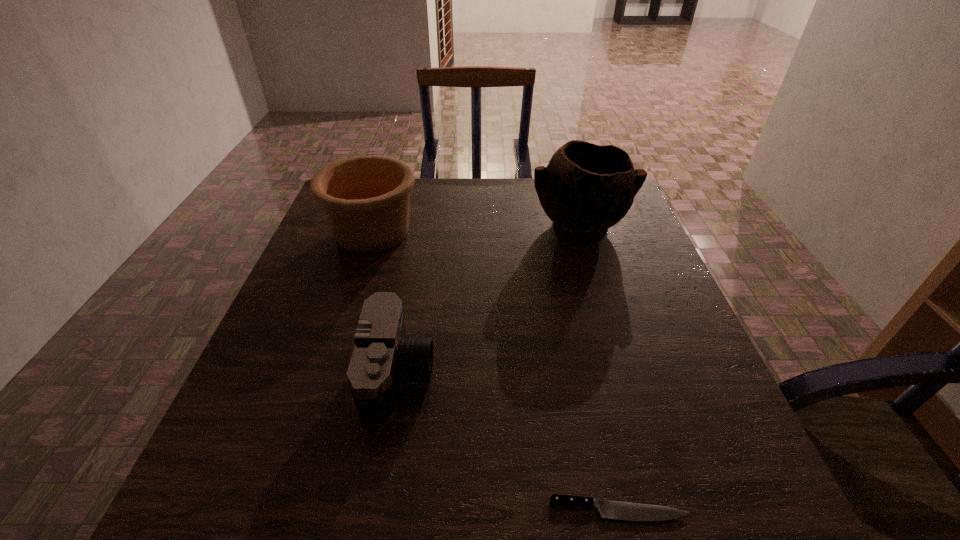
Where is `vacant area between the tallest object and the second nearest object`? vacant area between the tallest object and the second nearest object is located at coordinates (490, 301).

Identify the location of free space between the left pottery and the nearest object. The image size is (960, 540). (496, 371).

Locate an element on the screen. Image resolution: width=960 pixels, height=540 pixels. free space between the second shortest object and the tallest object is located at coordinates (490, 301).

Locate which object is the third closest to the shorter pottery. Please provide its 2D coordinates. Your answer should be formatted as a tuple, i.e. [(x, y)], where the tuple contains the x and y coordinates of a point satisfying the conditions above.

[(615, 510)]

The image size is (960, 540). I want to click on the closest object to the tallest object, so click(365, 199).

This screenshot has height=540, width=960. What are the coordinates of `vacant area in the image that satisfies the following two spatial constraints: 1. on the front-facing side of the second shortest object; 2. on the left side of the shortest object` in the screenshot? It's located at (377, 510).

This screenshot has height=540, width=960. What are the coordinates of `vacant region that satisfies the following two spatial constraints: 1. on the front-facing side of the nearest object; 2. on the left side of the second shortest object` in the screenshot? It's located at (377, 510).

What are the coordinates of `free space in the image that satisfies the following two spatial constraints: 1. on the front side of the tallest object; 2. on the front-facing side of the third tallest object` in the screenshot? It's located at (625, 376).

Where is `vacant space that satisfies the following two spatial constraints: 1. on the front-facing side of the camera; 2. on the right side of the shortest object`? Image resolution: width=960 pixels, height=540 pixels. vacant space that satisfies the following two spatial constraints: 1. on the front-facing side of the camera; 2. on the right side of the shortest object is located at coordinates (377, 510).

You are a GUI agent. You are given a task and a screenshot of the screen. Output one action in this format:
    pyautogui.click(x=<x>, y=<y>)
    Task: Click on the free space that satisfies the following two spatial constraints: 1. on the front-facing side of the third farthest object; 2. on the back side of the shortest object
    This screenshot has width=960, height=540.
    Given the screenshot: What is the action you would take?
    pyautogui.click(x=377, y=510)